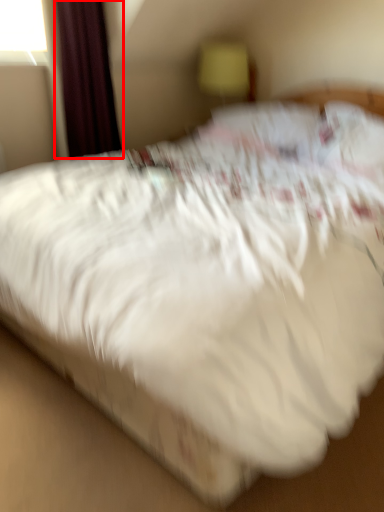
Question: Considering the relative positions of curtain (annotated by the red box) and table lamp in the image provided, where is curtain (annotated by the red box) located with respect to the staircase?

Choices:
 (A) left
 (B) right

Answer: (A)